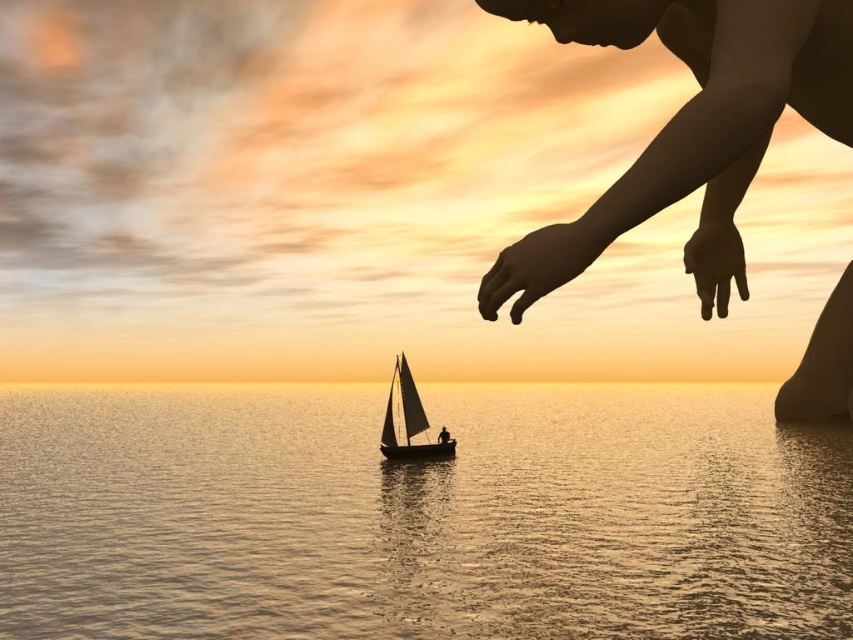
Is silvery reflective water at center bigger than silhouette skin at upper right?

Yes.

Is point (426, 595) more distant than point (822, 80)?

Yes, point (426, 595) is behind point (822, 80).

Between point (459, 436) and point (747, 58), which one is positioned behind?

The point (459, 436) is more distant.

The image size is (853, 640). I want to click on silvery reflective water at center, so click(x=419, y=515).

Does silhouette skin at upper right have a greater width compared to silky white sail at center?

Incorrect, silhouette skin at upper right's width does not surpass silky white sail at center's.

Is point (804, 419) positioned behind point (439, 442)?

That is False.

At what (x,y) coordinates should I click in order to perform the action: click on silhouette skin at upper right. Please return your answer as a coordinate pair (x, y). Looking at the image, I should click on (688, 128).

Is silvery reflective water at center thinner than silky white sail at center?

In fact, silvery reflective water at center might be wider than silky white sail at center.

Who is positioned more to the left, silvery reflective water at center or silky white sail at center?

silvery reflective water at center is more to the left.

Describe the element at coordinates (419, 515) in the screenshot. This screenshot has height=640, width=853. I see `silvery reflective water at center` at that location.

In order to click on silvery reflective water at center in this screenshot , I will do `click(419, 515)`.